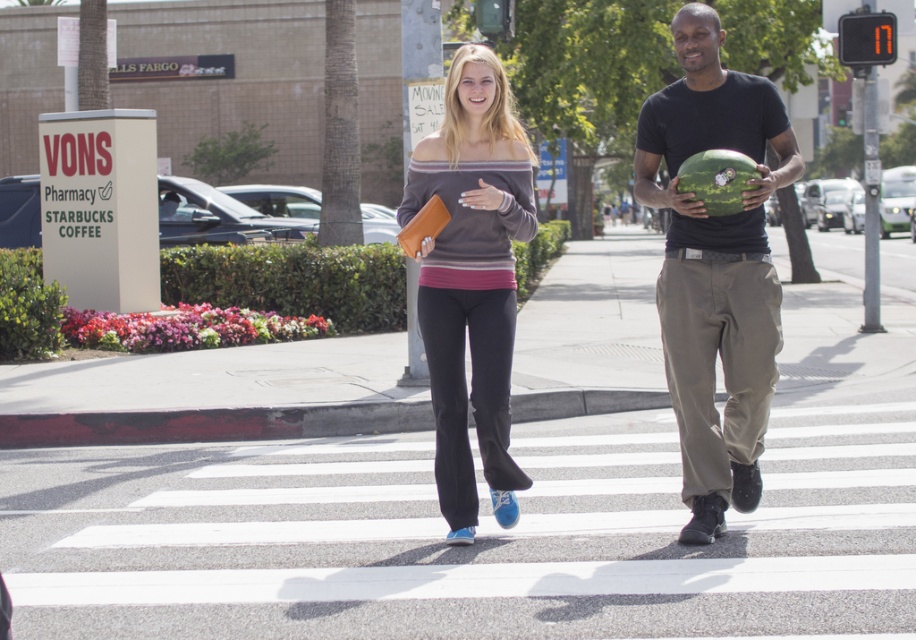
Which is in front, point (463, 282) or point (753, 177)?

Positioned in front is point (753, 177).

The image size is (916, 640). Describe the element at coordinates (472, 280) in the screenshot. I see `matte gray sweater at center` at that location.

Where is `matte gray sweater at center`? The width and height of the screenshot is (916, 640). matte gray sweater at center is located at coordinates (472, 280).

Can you confirm if matte black shirt at center is thinner than green textured melon at center?

No, matte black shirt at center is not thinner than green textured melon at center.

The width and height of the screenshot is (916, 640). What do you see at coordinates (715, 268) in the screenshot? I see `matte black shirt at center` at bounding box center [715, 268].

You are a GUI agent. You are given a task and a screenshot of the screen. Output one action in this format:
    pyautogui.click(x=<x>, y=<y>)
    Task: Click on the matte black shirt at center
    The width and height of the screenshot is (916, 640).
    Given the screenshot: What is the action you would take?
    pyautogui.click(x=715, y=268)

Does matte black shirt at center have a larger size compared to matte gray sweater at center?

No, matte black shirt at center is not bigger than matte gray sweater at center.

Does matte black shirt at center have a greater width compared to matte gray sweater at center?

Yes.

Is point (687, 209) less distant than point (442, 348)?

Yes, point (687, 209) is in front of point (442, 348).

Find the location of a particular element. This screenshot has height=640, width=916. matte black shirt at center is located at coordinates (715, 268).